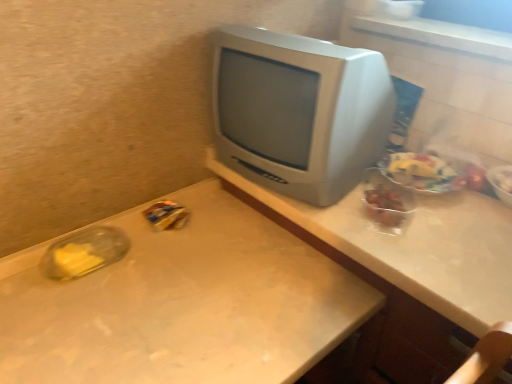
I want to click on vacant region in front of translucent plastic container at right, which appears as the 2th food when viewed from the left, so pyautogui.click(x=425, y=256).